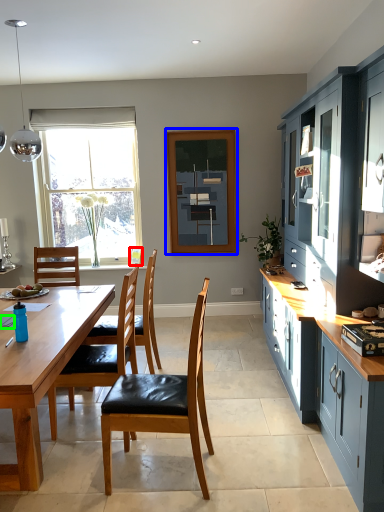
Question: Estimate the real-world distances between objects in this image. Which object is closer to picture frame (highlighted by a red box), window screen (highlighted by a blue box) or power plugs and sockets (highlighted by a green box)?

Choices:
 (A) window screen
 (B) power plugs and sockets

Answer: (A)